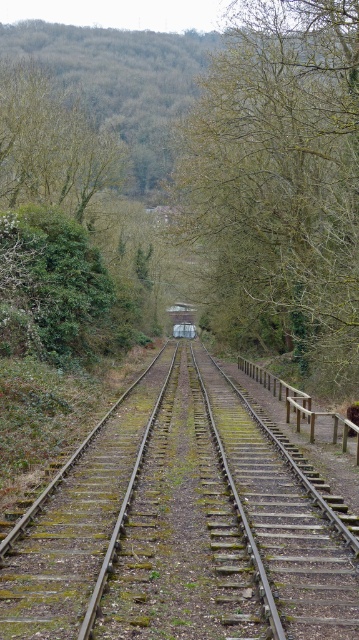
You are a photographer standing at the edge of the railway tracks. You want to capture a photo where the metallic silver train at center is framed by the green leafy tree at upper center. Given their sizes, will the tree be able to fully cover the train in the photo?

The green leafy tree at upper center is taller than the metallic silver train at center, so it can fully cover the train in the photo.

You are standing at the entrance of the tunnel and see two points marked on the railway tracks. The first point is at coordinate point (x=344, y=317) and the second is at coordinate point (x=19, y=182). Which point is closer to you?

Point (x=344, y=317) is closer to the viewer than point (x=19, y=182).

You are a photographer standing at the entrance of the tunnel. You want to capture a photo of both the green mossy metal track at center and the metallic silver train at center. Which object will appear taller in the photo?

The metallic silver train at center is taller than the green mossy metal track at center, so it will appear taller in the photo.